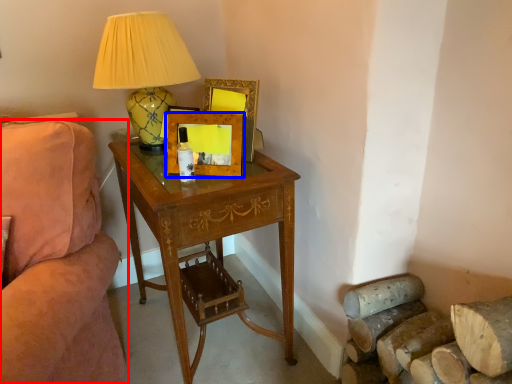
Question: Which object appears closest to the camera in this image, studio couch (highlighted by a red box) or picture frame (highlighted by a blue box)?

Choices:
 (A) studio couch
 (B) picture frame

Answer: (A)